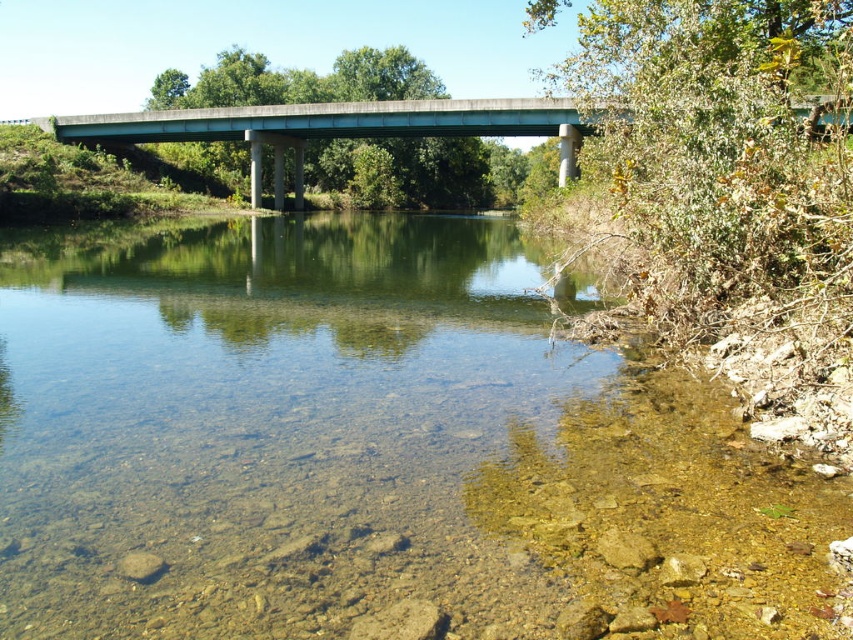
Question: Among these objects, which one is nearest to the camera?

Choices:
 (A) clear gravel river at center
 (B) concrete bridge at center

Answer: (A)

Question: Can you confirm if clear gravel river at center is smaller than concrete bridge at center?

Choices:
 (A) yes
 (B) no

Answer: (A)

Question: Can you confirm if clear gravel river at center is bigger than concrete bridge at center?

Choices:
 (A) yes
 (B) no

Answer: (B)

Question: Does clear gravel river at center have a greater width compared to concrete bridge at center?

Choices:
 (A) no
 (B) yes

Answer: (A)

Question: Which object appears farthest from the camera in this image?

Choices:
 (A) concrete bridge at center
 (B) clear gravel river at center

Answer: (A)